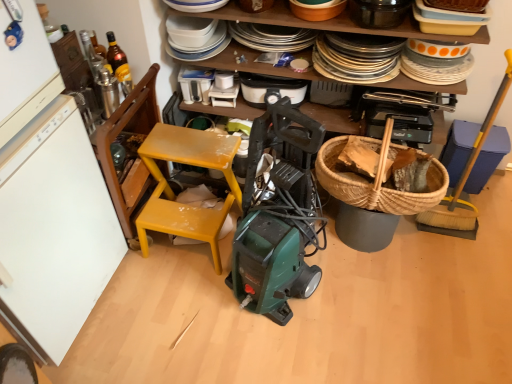
Where is `free point in front of yellow matte chair at center`? This screenshot has height=384, width=512. free point in front of yellow matte chair at center is located at coordinates (177, 307).